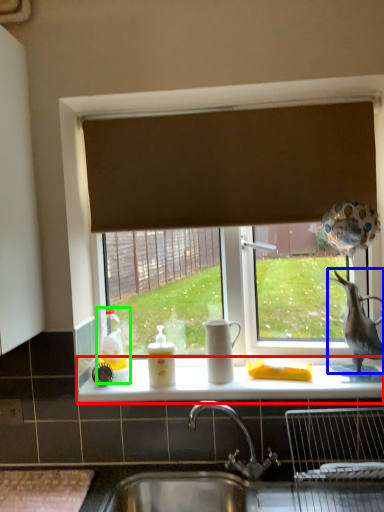
Question: Which object is positioned closest to counter top (highlighted by a red box)? Select from animal (highlighted by a blue box) and toy (highlighted by a green box).

Choices:
 (A) animal
 (B) toy

Answer: (B)